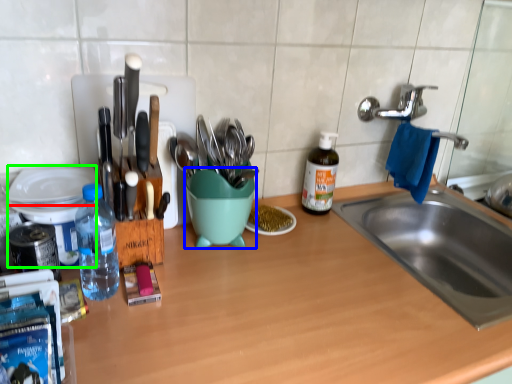
Question: Which object is the closest to the plate (highlighted by a red box)? Choose among these: mixing bowl (highlighted by a blue box) or appliance (highlighted by a green box).

Choices:
 (A) mixing bowl
 (B) appliance

Answer: (B)